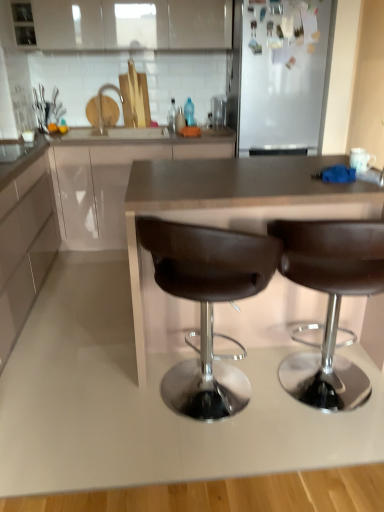
At what (x,y) coordinates should I click in order to perform the action: click on free space on the front side of brown leather stool at center, acting as the 2th chair starting from the left. Please return your answer as a coordinate pair (x, y). This screenshot has height=512, width=384. Looking at the image, I should click on (326, 458).